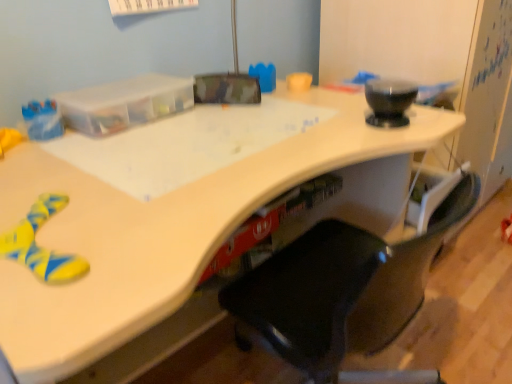
Question: Can you confirm if black plastic chair at center is smaller than rubberized red toy at lower right?

Choices:
 (A) no
 (B) yes

Answer: (A)

Question: From the image's perspective, would you say black plastic chair at center is shown under rubberized red toy at lower right?

Choices:
 (A) no
 (B) yes

Answer: (B)

Question: From a real-world perspective, is black plastic chair at center positioned over rubberized red toy at lower right based on gravity?

Choices:
 (A) yes
 (B) no

Answer: (A)

Question: Is the position of black plastic chair at center less distant than that of rubberized red toy at lower right?

Choices:
 (A) no
 (B) yes

Answer: (B)

Question: Is black plastic chair at center outside of rubberized red toy at lower right?

Choices:
 (A) yes
 (B) no

Answer: (A)

Question: In the image, is black plastic chair at center positioned in front of or behind rubberized red toy at lower right?

Choices:
 (A) front
 (B) behind

Answer: (A)

Question: From the image's perspective, is black plastic chair at center positioned above or below rubberized red toy at lower right?

Choices:
 (A) below
 (B) above

Answer: (A)

Question: Is black plastic chair at center wider or thinner than rubberized red toy at lower right?

Choices:
 (A) wide
 (B) thin

Answer: (A)

Question: Does point (331, 246) appear closer or farther from the camera than point (506, 233)?

Choices:
 (A) farther
 (B) closer

Answer: (B)

Question: Considering the positions of point (501, 231) and point (204, 233), is point (501, 231) closer or farther from the camera than point (204, 233)?

Choices:
 (A) farther
 (B) closer

Answer: (A)

Question: Is rubberized red toy at lower right taller or shorter than white glossy desk at lower left?

Choices:
 (A) short
 (B) tall

Answer: (B)

Question: From a real-world perspective, is rubberized red toy at lower right above or below white glossy desk at lower left?

Choices:
 (A) above
 (B) below

Answer: (A)

Question: In the image, is rubberized red toy at lower right positioned in front of or behind white glossy desk at lower left?

Choices:
 (A) front
 (B) behind

Answer: (B)

Question: From the image's perspective, relative to white glossy desk at lower left, is black plastic chair at center above or below?

Choices:
 (A) below
 (B) above

Answer: (B)

Question: Is black plastic chair at center spatially inside white glossy desk at lower left, or outside of it?

Choices:
 (A) inside
 (B) outside

Answer: (B)